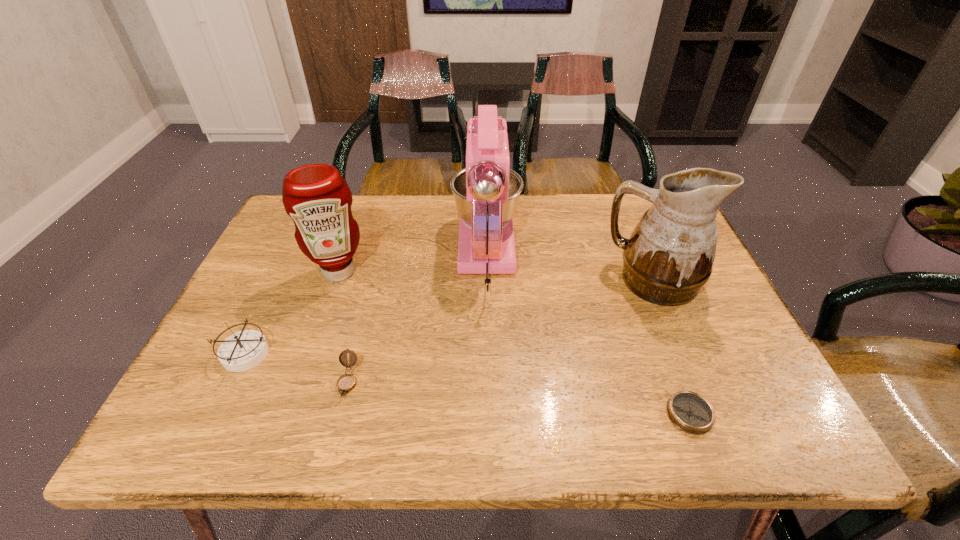
Identify the location of mixer. The height and width of the screenshot is (540, 960). (486, 192).

The height and width of the screenshot is (540, 960). Identify the location of pitcher. (669, 256).

This screenshot has height=540, width=960. What are the coordinates of `the second object from left to right` in the screenshot? It's located at (317, 198).

The height and width of the screenshot is (540, 960). What are the coordinates of `the third shortest object` in the screenshot? It's located at (243, 350).

This screenshot has height=540, width=960. I want to click on the leftmost object, so click(243, 350).

At what (x,y) coordinates should I click in order to perform the action: click on the fifth tallest object. Please return your answer as a coordinate pair (x, y). The image size is (960, 540). Looking at the image, I should click on (345, 383).

Image resolution: width=960 pixels, height=540 pixels. What are the coordinates of `the second compass from right to left` in the screenshot? It's located at point(345,383).

This screenshot has height=540, width=960. In order to click on the shortest compass in this screenshot , I will do `click(690, 412)`.

The height and width of the screenshot is (540, 960). I want to click on the rightmost compass, so click(x=690, y=412).

The width and height of the screenshot is (960, 540). What are the coordinates of `vacant space located on the face of the mixer` in the screenshot? It's located at (486, 198).